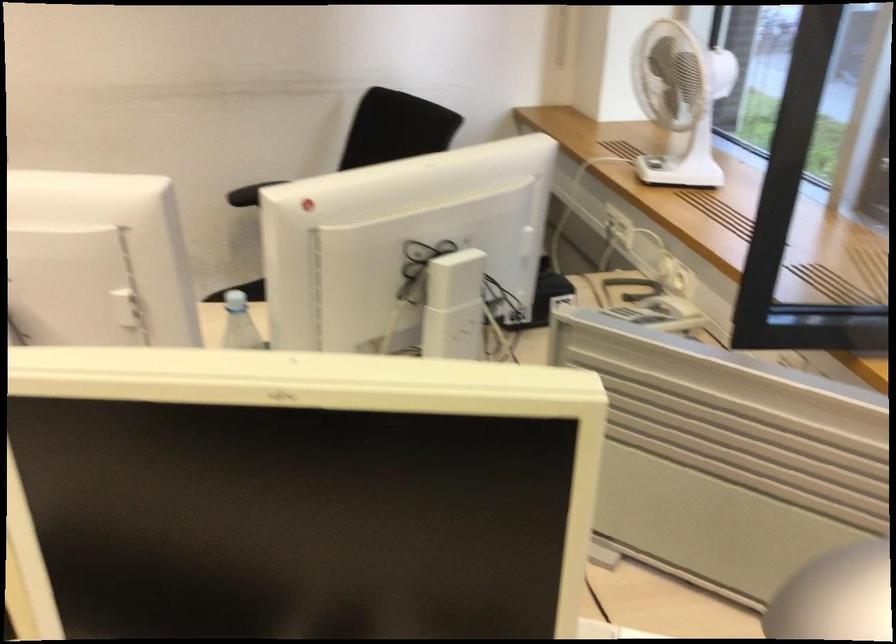
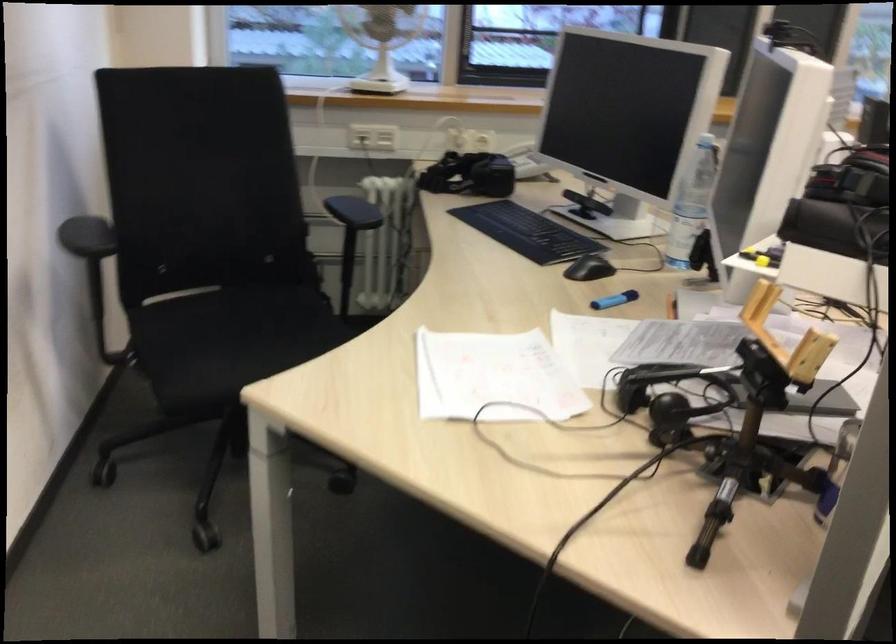
Locate, in the second image, the point that corresponds to (x=631, y=229) in the first image.

(385, 138)